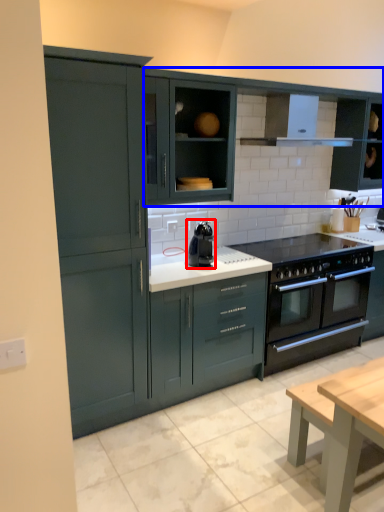
Question: Which of the following is the farthest to the observer, kitchen appliance (highlighted by a red box) or cabinetry (highlighted by a blue box)?

Choices:
 (A) kitchen appliance
 (B) cabinetry

Answer: (B)